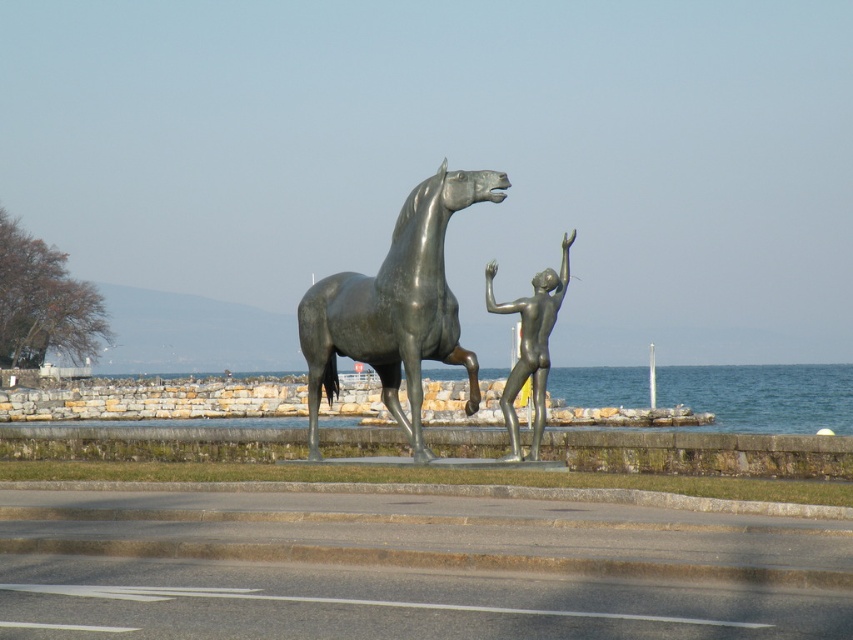
Who is more forward, [457,317] or [531,340]?

Positioned in front is point [531,340].

Is bronze horse at center to the left of bronze nude figure at center from the viewer's perspective?

Correct, you'll find bronze horse at center to the left of bronze nude figure at center.

What are the coordinates of `bronze horse at center` in the screenshot? It's located at (396, 307).

The height and width of the screenshot is (640, 853). In order to click on bronze horse at center in this screenshot , I will do `click(396, 307)`.